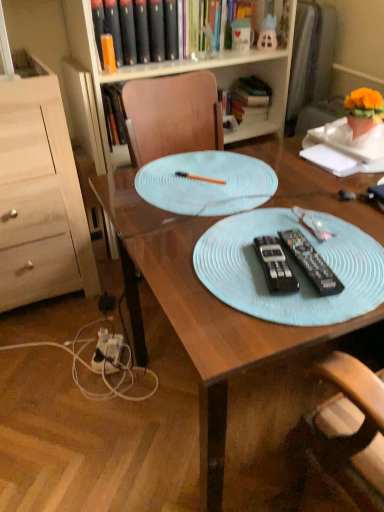
Where is `vacant space that is to the left of white paper at upper right`? Image resolution: width=384 pixels, height=512 pixels. vacant space that is to the left of white paper at upper right is located at coordinates (282, 166).